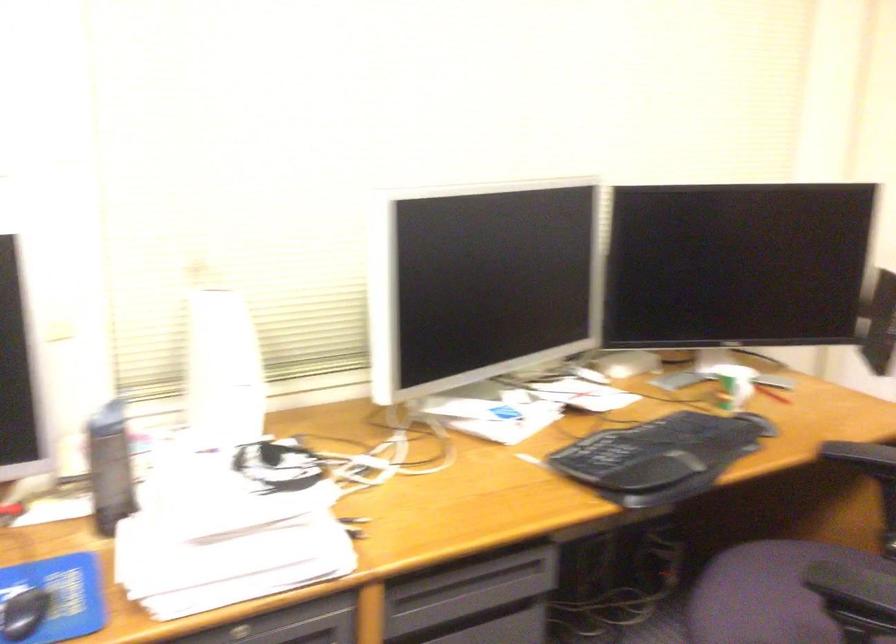
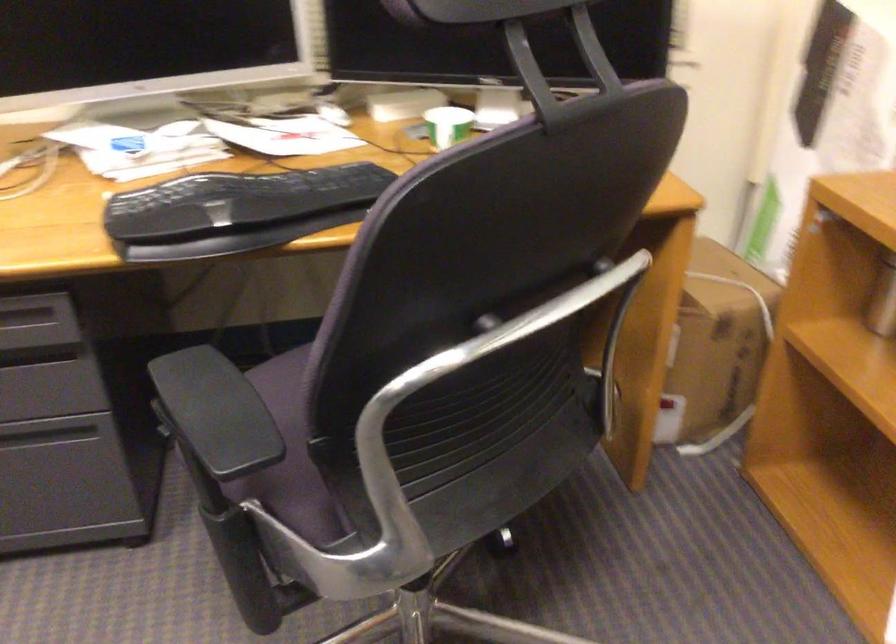
Which direction would the cameraman need to move to produce the second image?

The cameraman moved toward right, forward.